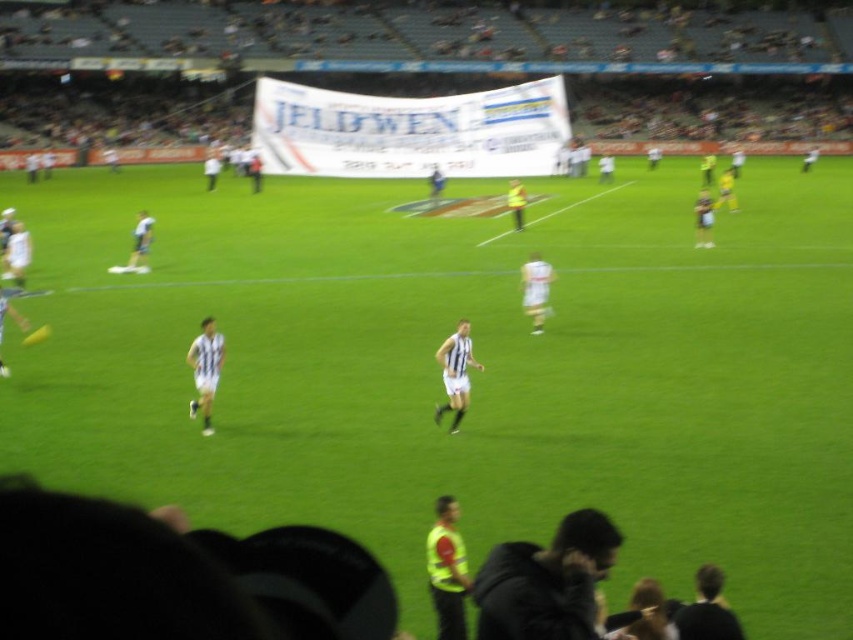
Between yellow reflective vest at lower center and white striped jersey at center, which one appears on the right side from the viewer's perspective?

From the viewer's perspective, yellow reflective vest at lower center appears more on the right side.

Can you confirm if yellow reflective vest at lower center is thinner than white striped jersey at center?

No.

Find the location of `yellow reflective vest at lower center`. yellow reflective vest at lower center is located at coordinates (546, 580).

Locate an element on the screen. The image size is (853, 640). yellow reflective vest at lower center is located at coordinates (546, 580).

Is point (509, 608) behind point (454, 532)?

No, it is in front of (454, 532).

Between yellow reflective vest at lower center and yellow reflective vest at center, which one has less height?

yellow reflective vest at lower center

Which is behind, point (527, 588) or point (440, 593)?

The point (440, 593) is more distant.

Identify the location of yellow reflective vest at lower center. The height and width of the screenshot is (640, 853). (546, 580).

Does point (442, 636) lie in front of point (212, 428)?

Yes, it is.

Can you confirm if yellow reflective vest at center is taller than white striped jersey at center?

No.

Find the location of a particular element. The image size is (853, 640). yellow reflective vest at center is located at coordinates (447, 570).